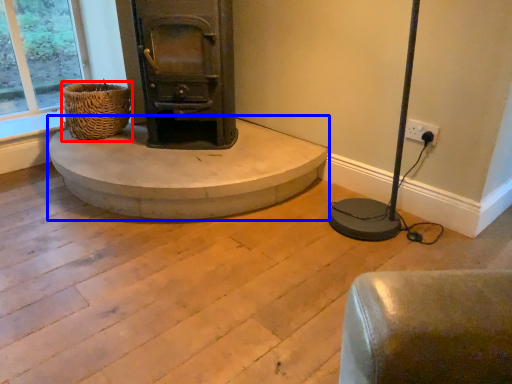
Question: Among these objects, which one is farthest to the camera, basket (highlighted by a red box) or concrete (highlighted by a blue box)?

Choices:
 (A) basket
 (B) concrete

Answer: (A)